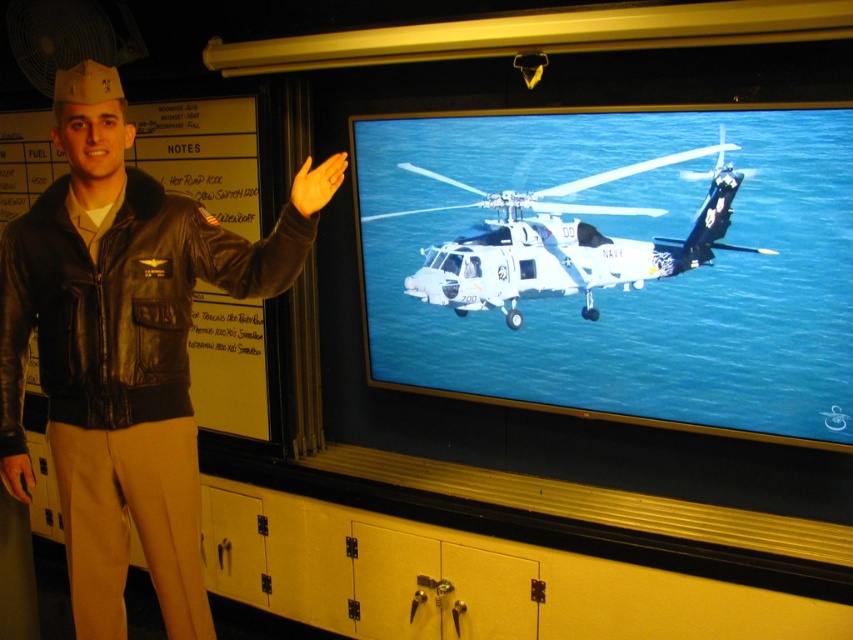
Question: Which point is closer to the camera taking this photo?

Choices:
 (A) (566, 225)
 (B) (169, 579)
 (C) (817, 157)

Answer: (B)

Question: Does black leather jacket at left have a lesser width compared to metallic gray helicopter at center?

Choices:
 (A) no
 (B) yes

Answer: (B)

Question: Considering the relative positions of white glossy helicopter at center and black leather jacket at left in the image provided, where is white glossy helicopter at center located with respect to black leather jacket at left?

Choices:
 (A) below
 (B) above

Answer: (B)

Question: Which point is closer to the camera?

Choices:
 (A) black leather jacket at left
 (B) metallic gray helicopter at center

Answer: (A)

Question: Which point is closer to the camera?

Choices:
 (A) metallic gray helicopter at center
 (B) white glossy helicopter at center
 (C) black leather jacket at left

Answer: (C)

Question: Can you confirm if white glossy helicopter at center is bigger than metallic gray helicopter at center?

Choices:
 (A) no
 (B) yes

Answer: (B)